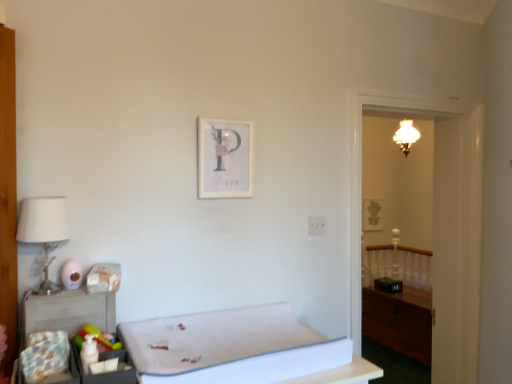
Question: From a real-world perspective, is wooden picture frame at right, marked as the 1th picture frame in a right-to-left arrangement, located higher than wooden table at lower left?

Choices:
 (A) yes
 (B) no

Answer: (A)

Question: Is wooden picture frame at right, the first picture frame positioned from the bottom, aimed at wooden table at lower left?

Choices:
 (A) no
 (B) yes

Answer: (A)

Question: Considering the relative positions of wooden picture frame at right, marked as the 1th picture frame in a right-to-left arrangement, and wooden table at lower left in the image provided, is wooden picture frame at right, marked as the 1th picture frame in a right-to-left arrangement, to the left of wooden table at lower left from the viewer's perspective?

Choices:
 (A) yes
 (B) no

Answer: (B)

Question: From the image's perspective, is wooden picture frame at right, the 2th picture frame positioned from the front, located above wooden table at lower left?

Choices:
 (A) no
 (B) yes

Answer: (B)

Question: Is wooden picture frame at right, the first picture frame positioned from the bottom, further to camera compared to wooden table at lower left?

Choices:
 (A) yes
 (B) no

Answer: (A)

Question: From a real-world perspective, is wooden picture frame at right, marked as the 2th picture frame in a top-to-bottom arrangement, below wooden table at lower left?

Choices:
 (A) no
 (B) yes

Answer: (A)

Question: Considering the relative sizes of matte paper picture frame at upper center, the second picture frame when ordered from back to front, and wooden armoire at left in the image provided, is matte paper picture frame at upper center, the second picture frame when ordered from back to front, bigger than wooden armoire at left?

Choices:
 (A) yes
 (B) no

Answer: (B)

Question: Is matte paper picture frame at upper center, which is the 1th picture frame in front-to-back order, thinner than wooden armoire at left?

Choices:
 (A) yes
 (B) no

Answer: (A)

Question: Does matte paper picture frame at upper center, the first picture frame positioned from the top, appear on the right side of wooden armoire at left?

Choices:
 (A) no
 (B) yes

Answer: (B)

Question: From the image's perspective, does matte paper picture frame at upper center, which is the second picture frame from right to left, appear lower than wooden armoire at left?

Choices:
 (A) yes
 (B) no

Answer: (B)

Question: Is matte paper picture frame at upper center, the second picture frame when ordered from back to front, not close to wooden armoire at left?

Choices:
 (A) no
 (B) yes

Answer: (A)

Question: Is matte paper picture frame at upper center, the first picture frame positioned from the top, with wooden armoire at left?

Choices:
 (A) yes
 (B) no

Answer: (B)

Question: Is white foam mattress at lower center shorter than wooden armoire at left?

Choices:
 (A) yes
 (B) no

Answer: (A)